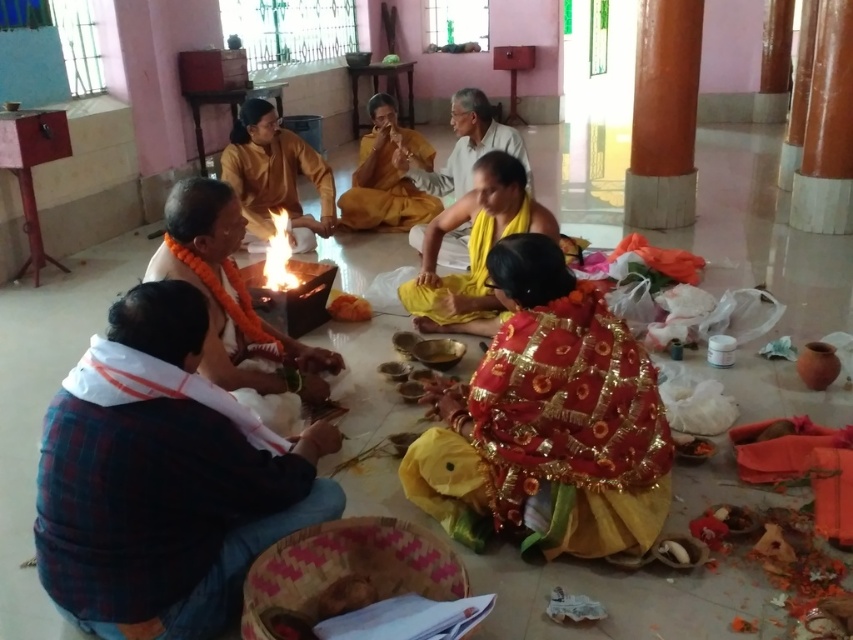
You are an observer standing in the temple. You notice the plaid fabric shirt at lower left and the yellow cloth at center. Which object is closer to the floor?

The plaid fabric shirt at lower left is positioned under the yellow cloth at center, so it is closer to the floor.

You are an interior designer planning to rearrange the items in the temple scene. You need to ensure that the plaid fabric shirt at lower left and the yellow cloth at center are placed in a way that the larger item is on the right side of the room. Which object should be moved to the right side?

The yellow cloth at center should be moved to the right side of the room because it occupies more space than the plaid fabric shirt at lower left.

You are standing in the temple and want to take a photo of both the point at coordinates point (x=421, y=268) and point (x=419, y=180). Which point will appear larger in your photo?

Point (x=421, y=268) is closer to the camera than point (x=419, y=180), so it will appear larger in the photo.